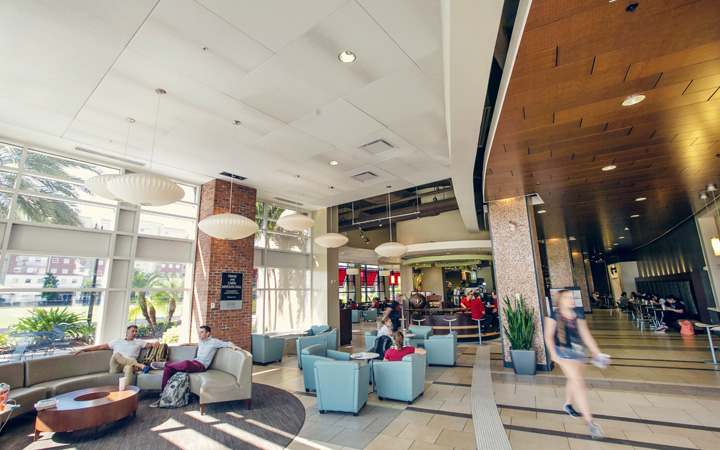
I want to click on glass, so click(x=63, y=219).